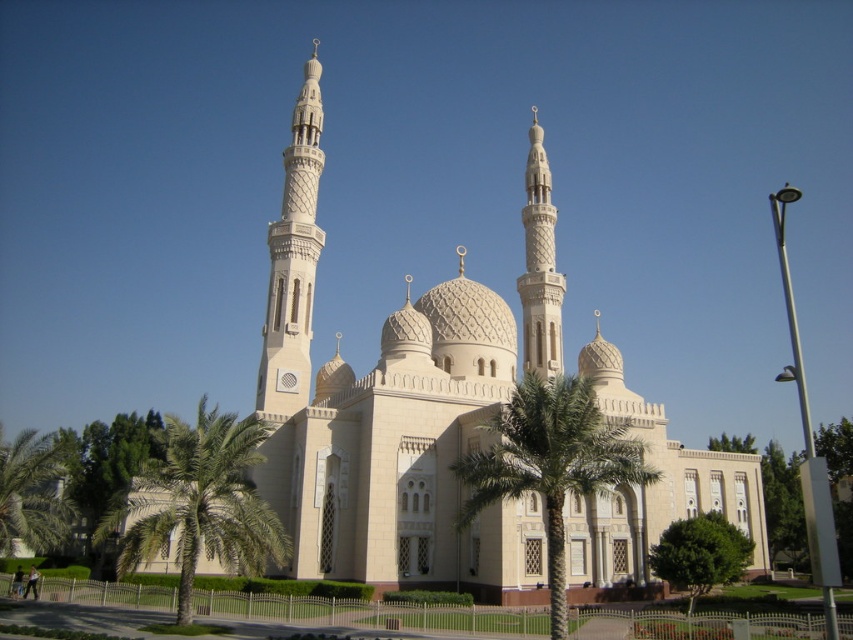
Is green leafy palm tree at left smaller than green leafy palm tree at center?

Actually, green leafy palm tree at left might be larger than green leafy palm tree at center.

Between point (140, 493) and point (593, 436), which one is positioned in front?

Point (593, 436) is in front.

The image size is (853, 640). I want to click on green leafy palm tree at left, so click(x=202, y=500).

Which is more to the right, white textured minaret at center-left or green leafy palm tree at lower left?

white textured minaret at center-left

Find the location of a particular element. white textured minaret at center-left is located at coordinates (293, 259).

Which is in front, point (177, 522) or point (15, 518)?

Positioned in front is point (177, 522).

Is green leafy palm tree at left positioned in front of green leafy palm tree at lower left?

Yes, green leafy palm tree at left is in front of green leafy palm tree at lower left.

Is point (227, 518) closer to camera compared to point (27, 476)?

Yes, it is in front of point (27, 476).

Locate an element on the screen. The image size is (853, 640). green leafy palm tree at left is located at coordinates (202, 500).